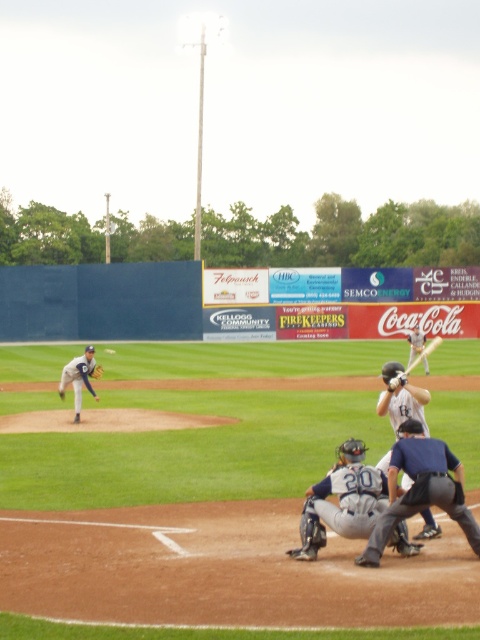
You are a photographer positioned at the edge of the field. You want to capture a photo where both the dark blue uniform at center and the dark gray leather glove at center are visible. Considering their sizes, which object will occupy more space in the photo?

The dark blue uniform at center has a greater height compared to the dark gray leather glove at center, so it will occupy more space in the photo.

You are a photographer positioned at the center of the field. You want to take a photo of the matte white bat at center. Based on its position, where should you aim your camera relative to the center of the frame?

The matte white bat at center is located at coordinates point 0.622 on the x axis and 0.835 on the y axis. To capture it, aim your camera slightly to the right and above the center of the frame.

You are a photographer positioned behind home plate. You want to take a photo that includes both the dark blue uniform at center and the dark gray leather glove at center. Which object will appear larger in your photo?

The dark blue uniform at center will appear larger in the photo because it is closer to the viewer than the dark gray leather glove at center.